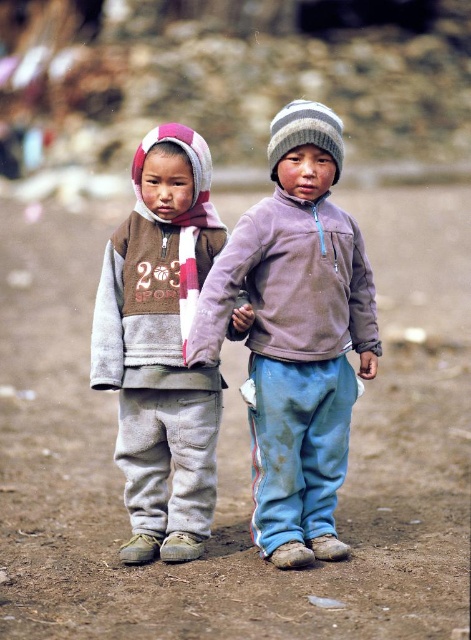
Question: Among these points, which one is nearest to the camera?

Choices:
 (A) (226, 582)
 (B) (295, 419)
 (C) (185, 486)
 (D) (276, 312)

Answer: (A)

Question: Which object is the closest to the light purple fleece jacket at center?

Choices:
 (A) brown dirt track at center
 (B) gray fleece jacket at left

Answer: (B)

Question: Which object is closer to the camera taking this photo?

Choices:
 (A) gray fleece jacket at left
 (B) matte purple sweatshirt at center
 (C) brown dirt track at center
 (D) light purple fleece jacket at center

Answer: (C)

Question: Considering the relative positions of brown dirt track at center and matte purple sweatshirt at center in the image provided, where is brown dirt track at center located with respect to matte purple sweatshirt at center?

Choices:
 (A) above
 (B) below

Answer: (A)

Question: Can you confirm if brown dirt track at center is positioned to the right of light purple fleece jacket at center?

Choices:
 (A) yes
 (B) no

Answer: (A)

Question: Does brown dirt track at center have a greater width compared to matte purple sweatshirt at center?

Choices:
 (A) no
 (B) yes

Answer: (B)